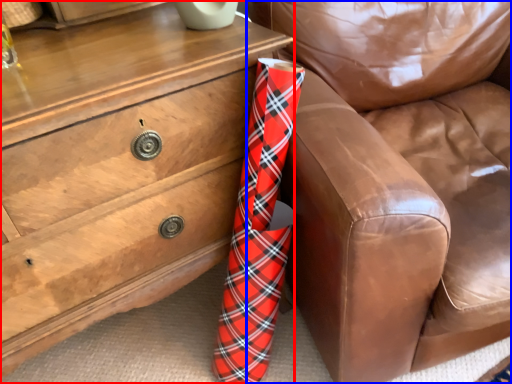
Question: Which point is closer to the camera, chest of drawers (highlighted by a red box) or furniture (highlighted by a blue box)?

Choices:
 (A) chest of drawers
 (B) furniture

Answer: (B)